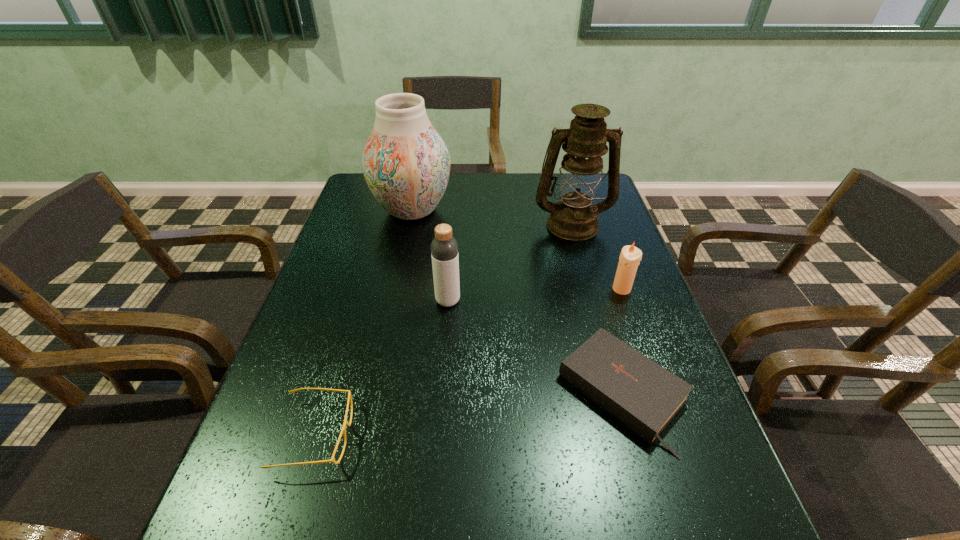
At what (x,y) coordinates should I click in order to perform the action: click on oil lamp. Please return your answer as a coordinate pair (x, y). Image resolution: width=960 pixels, height=540 pixels. Looking at the image, I should click on (574, 218).

Find the location of a particular element. vase is located at coordinates (406, 164).

The height and width of the screenshot is (540, 960). Identify the location of the third tallest object. (444, 248).

In order to click on candle in this screenshot , I will do `click(630, 256)`.

Locate an element on the screen. The image size is (960, 540). spectacles is located at coordinates (343, 430).

The image size is (960, 540). I want to click on Bible, so click(644, 396).

The height and width of the screenshot is (540, 960). Find the location of `free location located on the left of the oil lamp`. free location located on the left of the oil lamp is located at coordinates (492, 224).

I want to click on vacant space located 0.390m on the front of the vase, so click(x=387, y=329).

At what (x,y) coordinates should I click in order to perform the action: click on vacant space situated 0.250m on the left of the bottle. Please return your answer as a coordinate pair (x, y). This screenshot has width=960, height=540. Looking at the image, I should click on coord(337,301).

You are a GUI agent. You are given a task and a screenshot of the screen. Output one action in this format:
    pyautogui.click(x=<x>, y=<y>)
    Task: Click on the vacant region located on the front of the candle
    Image resolution: width=960 pixels, height=540 pixels.
    Given the screenshot: What is the action you would take?
    pyautogui.click(x=629, y=309)